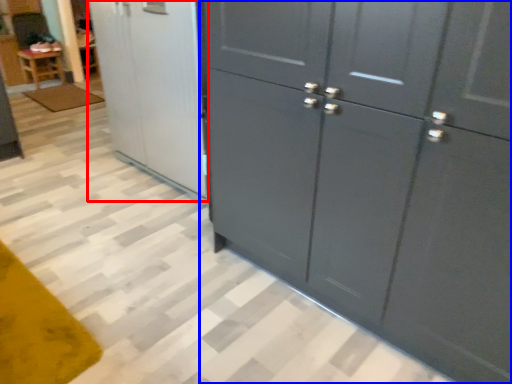
Question: Which of the following is the farthest to the observer, screen door (highlighted by a red box) or cupboard (highlighted by a blue box)?

Choices:
 (A) screen door
 (B) cupboard

Answer: (A)